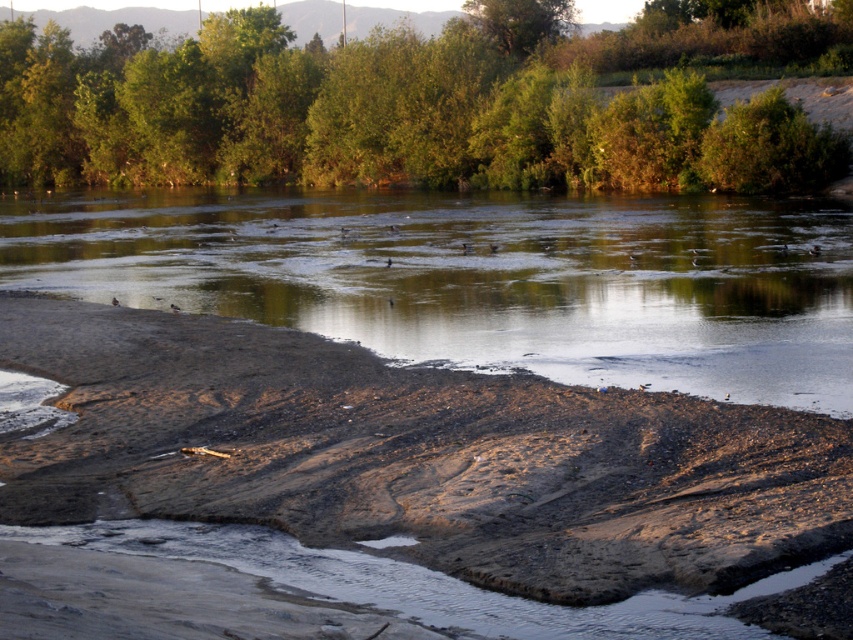
You are standing on the brown sandy beach at lower left and want to walk to the brown dirt at lower center. Which direction should you move to reach the higher ground?

The brown sandy beach at lower left has a lesser height compared to brown dirt at lower center, so you should move towards the brown dirt at lower center to reach higher ground.

You are standing on the brown dirt at lower center and want to reach the green leafy trees at upper center. Which direction should you move towards?

You should move upwards towards the green leafy trees at upper center since the brown dirt at lower center is located below them.